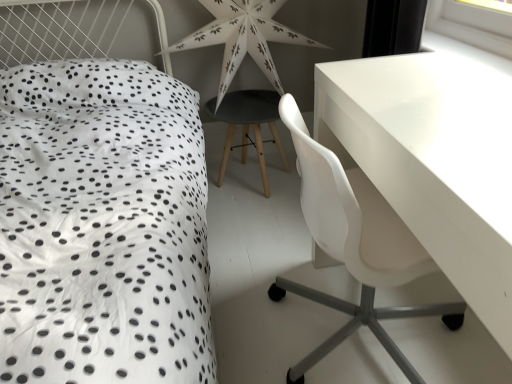
Question: In terms of width, does matte black stool at center look wider or thinner when compared to white plastic chair at right?

Choices:
 (A) thin
 (B) wide

Answer: (A)

Question: From a real-world perspective, relative to white plastic chair at right, is matte black stool at center vertically above or below?

Choices:
 (A) above
 (B) below

Answer: (B)

Question: Estimate the real-world distances between objects in this image. Which object is farther from the white plastic chair at right?

Choices:
 (A) white paper star at center
 (B) matte black stool at center

Answer: (A)

Question: Estimate the real-world distances between objects in this image. Which object is closer to the white plastic chair at right?

Choices:
 (A) white paper star at center
 (B) matte black stool at center

Answer: (B)